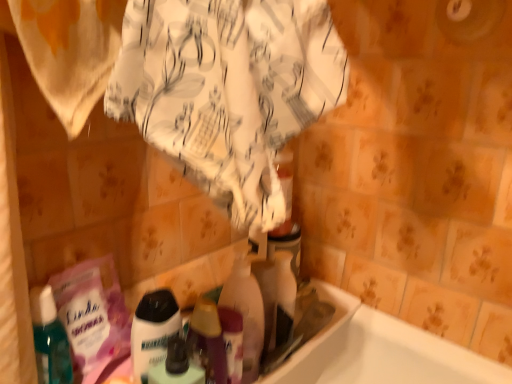
What do you see at coordinates (276, 297) in the screenshot?
I see `translucent plastic bottle at center, the 1th cleaning product positioned from the right` at bounding box center [276, 297].

The width and height of the screenshot is (512, 384). Identify the location of translucent plastic bottle at center, which is the 3th cleaning product in right-to-left order. (153, 331).

This screenshot has width=512, height=384. Describe the element at coordinates (246, 313) in the screenshot. I see `translucent plastic bottle at center, which is counted as the second cleaning product, starting from the left` at that location.

I want to click on translucent plastic bottle at center, the third cleaning product viewed from the left, so click(276, 297).

Is point (274, 268) closer to camera compared to point (247, 336)?

No, (274, 268) is further to viewer.

Is translucent plastic bottle at center, the third cleaning product viewed from the left, oriented towards translucent plastic bottle at center, arranged as the second cleaning product when viewed from the right?

No, translucent plastic bottle at center, the third cleaning product viewed from the left, is not turned towards translucent plastic bottle at center, arranged as the second cleaning product when viewed from the right.

Do you think translucent plastic bottle at center, the third cleaning product viewed from the left, is within translucent plastic bottle at center, arranged as the second cleaning product when viewed from the right, or outside of it?

translucent plastic bottle at center, the third cleaning product viewed from the left, lies outside translucent plastic bottle at center, arranged as the second cleaning product when viewed from the right.

Is translucent plastic bottle at center, the 1th cleaning product positioned from the right, wider than translucent plastic bottle at center, which is counted as the second cleaning product, starting from the left?

Yes, translucent plastic bottle at center, the 1th cleaning product positioned from the right, is wider than translucent plastic bottle at center, which is counted as the second cleaning product, starting from the left.

Considering their positions, is translucent plastic bottle at center, the 1th cleaning product in the left-to-right sequence, located in front of or behind translucent plastic bottle at center, which is counted as the second cleaning product, starting from the left?

Clearly, translucent plastic bottle at center, the 1th cleaning product in the left-to-right sequence, is in front of translucent plastic bottle at center, which is counted as the second cleaning product, starting from the left.

Is point (146, 382) in front of point (243, 370)?

Yes.

How far apart are translucent plastic bottle at center, the 1th cleaning product in the left-to-right sequence, and translucent plastic bottle at center, arranged as the second cleaning product when viewed from the right?

The distance of translucent plastic bottle at center, the 1th cleaning product in the left-to-right sequence, from translucent plastic bottle at center, arranged as the second cleaning product when viewed from the right, is 4.91 inches.

Which cleaning product is the 1st one when counting from the back of the translucent plastic bottle at center, the 1th cleaning product in the left-to-right sequence? Please provide its 2D coordinates.

[(246, 313)]

From a real-world perspective, between translucent plastic bottle at center, the 1th cleaning product in the left-to-right sequence, and translucent plastic bottle at center, the third cleaning product viewed from the left, who is vertically lower?

translucent plastic bottle at center, the third cleaning product viewed from the left.

Who is taller, translucent plastic bottle at center, the 1th cleaning product in the left-to-right sequence, or translucent plastic bottle at center, the 1th cleaning product positioned from the right?

translucent plastic bottle at center, the 1th cleaning product in the left-to-right sequence, is taller.

In terms of width, does translucent plastic bottle at center, the 1th cleaning product in the left-to-right sequence, look wider or thinner when compared to translucent plastic bottle at center, the third cleaning product viewed from the left?

Clearly, translucent plastic bottle at center, the 1th cleaning product in the left-to-right sequence, has less width compared to translucent plastic bottle at center, the third cleaning product viewed from the left.

Considering the sizes of translucent plastic bottle at center, which is the 3th cleaning product in right-to-left order, and translucent plastic bottle at center, the third cleaning product viewed from the left, in the image, is translucent plastic bottle at center, which is the 3th cleaning product in right-to-left order, bigger or smaller than translucent plastic bottle at center, the third cleaning product viewed from the left,?

translucent plastic bottle at center, which is the 3th cleaning product in right-to-left order, is smaller than translucent plastic bottle at center, the third cleaning product viewed from the left.

Which point is more distant from viewer, (254, 334) or (166, 289)?

The point (166, 289) is farther.

Can you confirm if translucent plastic bottle at center, which is counted as the second cleaning product, starting from the left, is shorter than translucent plastic bottle at center, which is the 3th cleaning product in right-to-left order?

Incorrect, the height of translucent plastic bottle at center, which is counted as the second cleaning product, starting from the left, does not fall short of that of translucent plastic bottle at center, which is the 3th cleaning product in right-to-left order.

From the image's perspective, is translucent plastic bottle at center, which is counted as the second cleaning product, starting from the left, positioned above or below translucent plastic bottle at center, the 1th cleaning product in the left-to-right sequence?

Clearly, from the image's perspective, translucent plastic bottle at center, which is counted as the second cleaning product, starting from the left, is above translucent plastic bottle at center, the 1th cleaning product in the left-to-right sequence.

Consider the image. From a real-world perspective, is translucent plastic bottle at center, which is counted as the second cleaning product, starting from the left, positioned above or below translucent plastic bottle at center, which is the 3th cleaning product in right-to-left order?

Clearly, from a real-world perspective, translucent plastic bottle at center, which is counted as the second cleaning product, starting from the left, is above translucent plastic bottle at center, which is the 3th cleaning product in right-to-left order.

Is translucent plastic bottle at center, the 1th cleaning product positioned from the right, not inside translucent plastic bottle at center, which is the 3th cleaning product in right-to-left order?

Indeed, translucent plastic bottle at center, the 1th cleaning product positioned from the right, is completely outside translucent plastic bottle at center, which is the 3th cleaning product in right-to-left order.

Are translucent plastic bottle at center, the third cleaning product viewed from the left, and translucent plastic bottle at center, the 1th cleaning product in the left-to-right sequence, located far from each other?

That's not correct — translucent plastic bottle at center, the third cleaning product viewed from the left, is a little close to translucent plastic bottle at center, the 1th cleaning product in the left-to-right sequence.

From a real-world perspective, is translucent plastic bottle at center, the third cleaning product viewed from the left, under translucent plastic bottle at center, which is the 3th cleaning product in right-to-left order?

Yes, from a real-world perspective, translucent plastic bottle at center, the third cleaning product viewed from the left, is below translucent plastic bottle at center, which is the 3th cleaning product in right-to-left order.

Considering the relative sizes of translucent plastic bottle at center, the third cleaning product viewed from the left, and translucent plastic bottle at center, which is the 3th cleaning product in right-to-left order, in the image provided, is translucent plastic bottle at center, the third cleaning product viewed from the left, smaller than translucent plastic bottle at center, which is the 3th cleaning product in right-to-left order,?

Actually, translucent plastic bottle at center, the third cleaning product viewed from the left, might be larger than translucent plastic bottle at center, which is the 3th cleaning product in right-to-left order.

Does translucent plastic bottle at center, which is counted as the second cleaning product, starting from the left, lie behind translucent plastic bottle at center, the 1th cleaning product positioned from the right?

No, translucent plastic bottle at center, which is counted as the second cleaning product, starting from the left, is in front of translucent plastic bottle at center, the 1th cleaning product positioned from the right.

Considering the relative sizes of translucent plastic bottle at center, arranged as the second cleaning product when viewed from the right, and translucent plastic bottle at center, the 1th cleaning product positioned from the right, in the image provided, is translucent plastic bottle at center, arranged as the second cleaning product when viewed from the right, wider than translucent plastic bottle at center, the 1th cleaning product positioned from the right,?

In fact, translucent plastic bottle at center, arranged as the second cleaning product when viewed from the right, might be narrower than translucent plastic bottle at center, the 1th cleaning product positioned from the right.

From the image's perspective, is translucent plastic bottle at center, arranged as the second cleaning product when viewed from the right, on top of translucent plastic bottle at center, the third cleaning product viewed from the left?

Yes, from the image's perspective, translucent plastic bottle at center, arranged as the second cleaning product when viewed from the right, is above translucent plastic bottle at center, the third cleaning product viewed from the left.

This screenshot has height=384, width=512. In order to click on the 1st cleaning product in front of the translucent plastic bottle at center, the third cleaning product viewed from the left, counting from the anchor's position in this screenshot , I will do `click(246, 313)`.

Image resolution: width=512 pixels, height=384 pixels. Find the location of `cleaning product that is the 2nd object located below the translucent plastic bottle at center, which is counted as the second cleaning product, starting from the left (from the image's perspective)`. cleaning product that is the 2nd object located below the translucent plastic bottle at center, which is counted as the second cleaning product, starting from the left (from the image's perspective) is located at coordinates (153, 331).

Considering their positions, is translucent plastic bottle at center, the third cleaning product viewed from the left, positioned closer to translucent plastic bottle at center, the 1th cleaning product in the left-to-right sequence, than translucent plastic bottle at center, which is counted as the second cleaning product, starting from the left?

translucent plastic bottle at center, which is counted as the second cleaning product, starting from the left, is positioned closer to the anchor translucent plastic bottle at center, the 1th cleaning product in the left-to-right sequence.

When comparing their distances from translucent plastic bottle at center, which is the 3th cleaning product in right-to-left order, does translucent plastic bottle at center, which is counted as the second cleaning product, starting from the left, or translucent plastic bottle at center, the third cleaning product viewed from the left, seem closer?

translucent plastic bottle at center, which is counted as the second cleaning product, starting from the left, lies closer to translucent plastic bottle at center, which is the 3th cleaning product in right-to-left order, than the other object.

Estimate the real-world distances between objects in this image. Which object is further from translucent plastic bottle at center, which is counted as the second cleaning product, starting from the left, translucent plastic bottle at center, the 1th cleaning product positioned from the right, or translucent plastic bottle at center, the 1th cleaning product in the left-to-right sequence?

Among the two, translucent plastic bottle at center, the 1th cleaning product in the left-to-right sequence, is located further to translucent plastic bottle at center, which is counted as the second cleaning product, starting from the left.

Which object lies nearer to the anchor point translucent plastic bottle at center, the 1th cleaning product positioned from the right, translucent plastic bottle at center, arranged as the second cleaning product when viewed from the right, or translucent plastic bottle at center, which is the 3th cleaning product in right-to-left order?

translucent plastic bottle at center, arranged as the second cleaning product when viewed from the right, lies closer to translucent plastic bottle at center, the 1th cleaning product positioned from the right, than the other object.

From the image, which object appears to be nearer to translucent plastic bottle at center, the 1th cleaning product positioned from the right, translucent plastic bottle at center, the 1th cleaning product in the left-to-right sequence, or translucent plastic bottle at center, arranged as the second cleaning product when viewed from the right?

The object closer to translucent plastic bottle at center, the 1th cleaning product positioned from the right, is translucent plastic bottle at center, arranged as the second cleaning product when viewed from the right.

From the image, which object appears to be nearer to translucent plastic bottle at center, which is counted as the second cleaning product, starting from the left, translucent plastic bottle at center, the 1th cleaning product in the left-to-right sequence, or translucent plastic bottle at center, the 1th cleaning product positioned from the right?

translucent plastic bottle at center, the 1th cleaning product positioned from the right, is closer to translucent plastic bottle at center, which is counted as the second cleaning product, starting from the left.

Image resolution: width=512 pixels, height=384 pixels. Find the location of `cleaning product located between translucent plastic bottle at center, which is the 3th cleaning product in right-to-left order, and translucent plastic bottle at center, the third cleaning product viewed from the left, in the left-right direction`. cleaning product located between translucent plastic bottle at center, which is the 3th cleaning product in right-to-left order, and translucent plastic bottle at center, the third cleaning product viewed from the left, in the left-right direction is located at coordinates click(x=246, y=313).